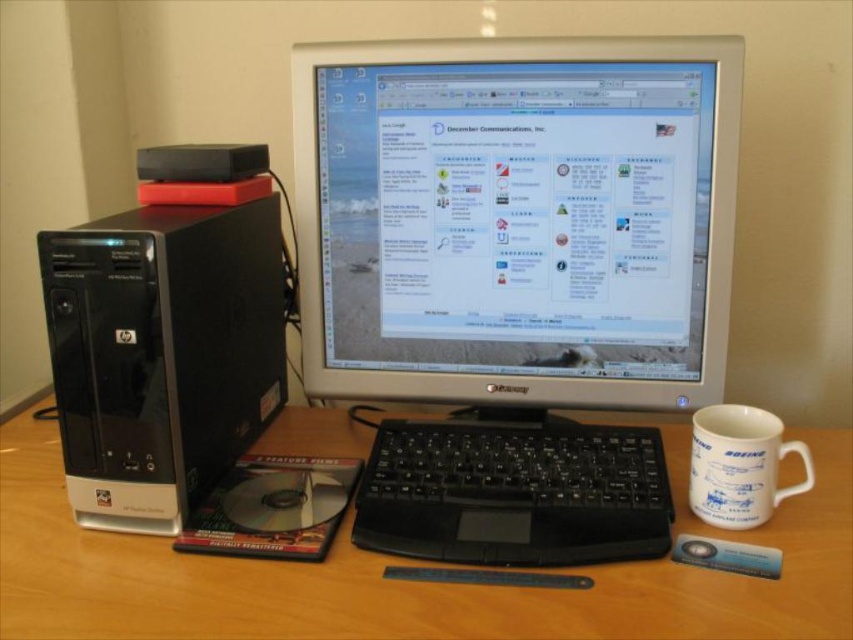
What object is located at the coordinates point (517, 220)?

The point (517, 220) indicates the silver plastic monitor at center.

You are a delivery robot with a 5.5 inch wide package. You need to place it between the black plastic keyboard at center and the white ceramic mug at right. Is there enough space?

The black plastic keyboard at center and white ceramic mug at right are 6.11 inches apart from each other. Since the package is 5.5 inches wide, there is enough space to place it between them.

You are organizing the desk and want to place a new item between the black plastic keyboard at center and the white ceramic mug at right. Is there enough space between them to fit a 10 cm wide item?

The black plastic keyboard at center is to the left of the white ceramic mug at right. Since the distance between them isn generated from the description, we cannot determine if there is enough space for a 10 cm wide item.